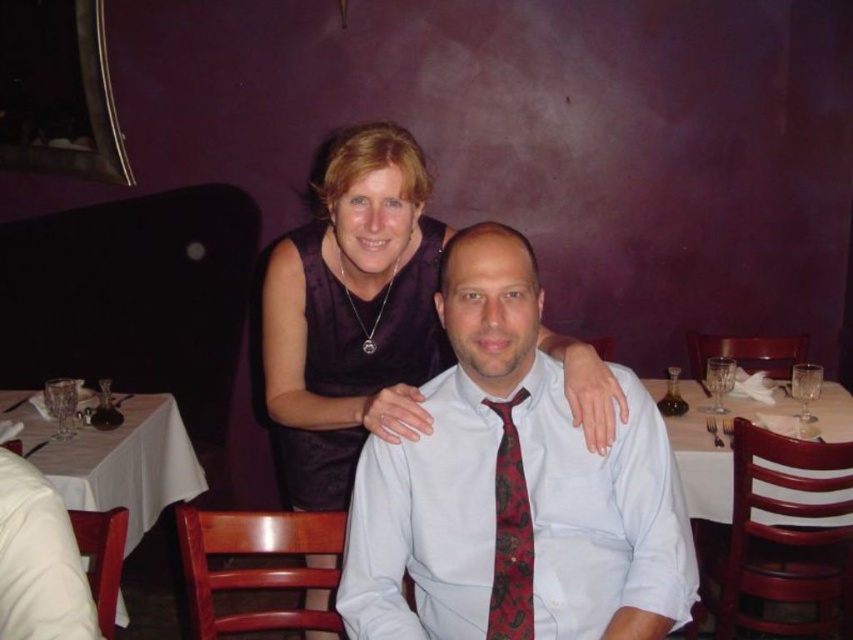
You are a photographer taking a picture of the purple satin dress at center and the white tablecloth at center. Which object should you focus on first if you want to capture both in sharp focus?

The white tablecloth at center is below the purple satin dress at center, so you should focus on the white tablecloth at center first to ensure both objects are in sharp focus.